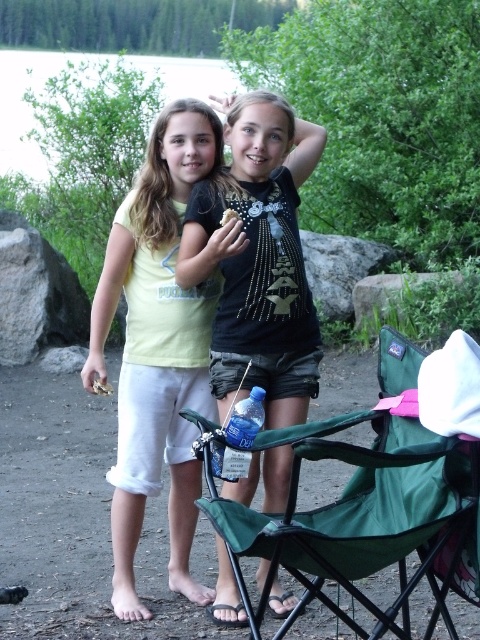
Question: Does green fabric chair at lower center appear over black matte shirt at center?

Choices:
 (A) no
 (B) yes

Answer: (A)

Question: In this image, where is green fabric chair at lower center located relative to black matte shirt at center?

Choices:
 (A) right
 (B) left

Answer: (A)

Question: Based on their relative distances, which object is nearer to the black matte shirt at center?

Choices:
 (A) green fabric chair at lower center
 (B) matte yellow t-shirt at center

Answer: (B)

Question: Is green fabric chair at lower center positioned behind black matte shirt at center?

Choices:
 (A) yes
 (B) no

Answer: (B)

Question: Which point is closer to the camera?

Choices:
 (A) (288, 547)
 (B) (118, 456)

Answer: (A)

Question: Which point is farther to the camera?

Choices:
 (A) matte yellow t-shirt at center
 (B) green fabric chair at lower center
 (C) black matte shirt at center

Answer: (A)